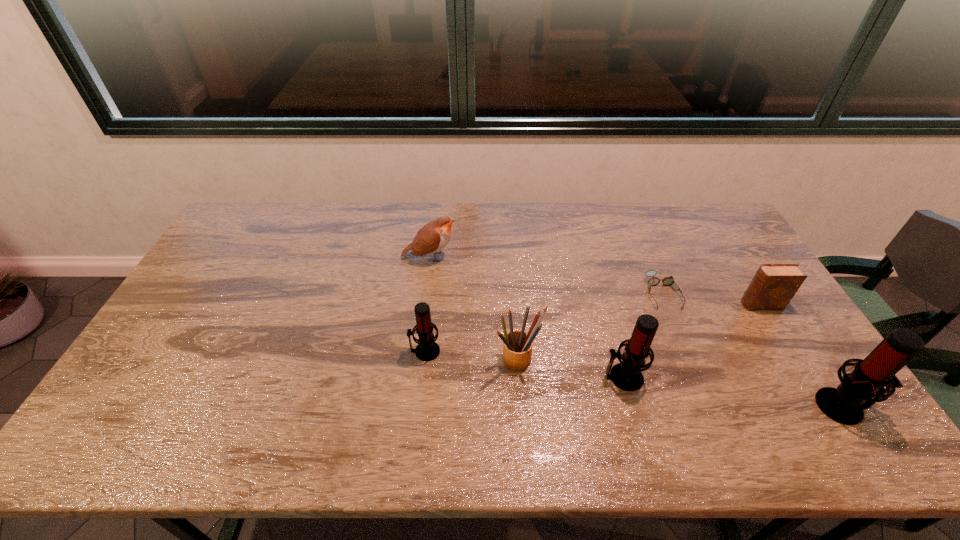
At what (x,y) coordinates should I click in order to perform the action: click on vacant place for an extra microphone on the left. Please return your answer as a coordinate pair (x, y). The height and width of the screenshot is (540, 960). Looking at the image, I should click on (246, 328).